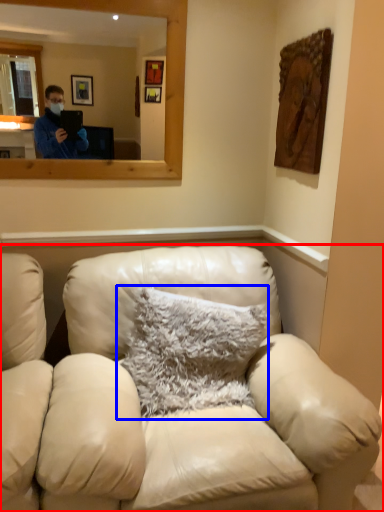
Question: Which point is further to the camera, studio couch (highlighted by a red box) or pillow (highlighted by a blue box)?

Choices:
 (A) studio couch
 (B) pillow

Answer: (B)